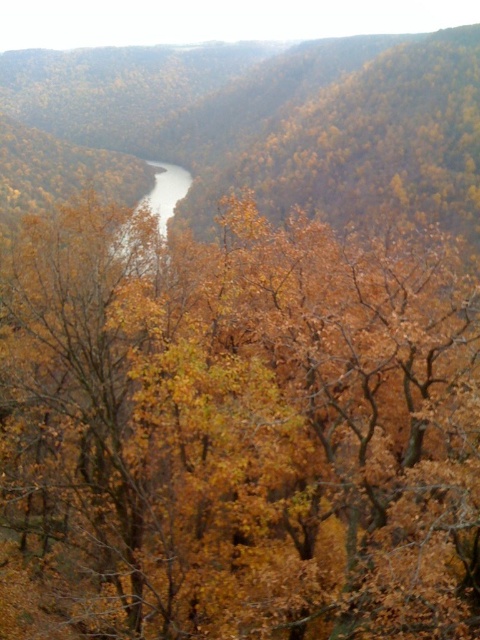
Question: Does yellow leafy tree at center have a smaller size compared to gray smooth water at center?

Choices:
 (A) yes
 (B) no

Answer: (A)

Question: Which point is farther to the camera?

Choices:
 (A) (52, 305)
 (B) (137, 262)

Answer: (B)

Question: Does yellow leafy tree at center have a lesser width compared to gray smooth water at center?

Choices:
 (A) no
 (B) yes

Answer: (A)

Question: Can you confirm if yellow leafy tree at center is positioned below gray smooth water at center?

Choices:
 (A) no
 (B) yes

Answer: (B)

Question: Among these points, which one is farthest from the camera?

Choices:
 (A) (154, 621)
 (B) (160, 212)

Answer: (B)

Question: Which object is farther from the camera taking this photo?

Choices:
 (A) yellow leafy tree at center
 (B) gray smooth water at center

Answer: (B)